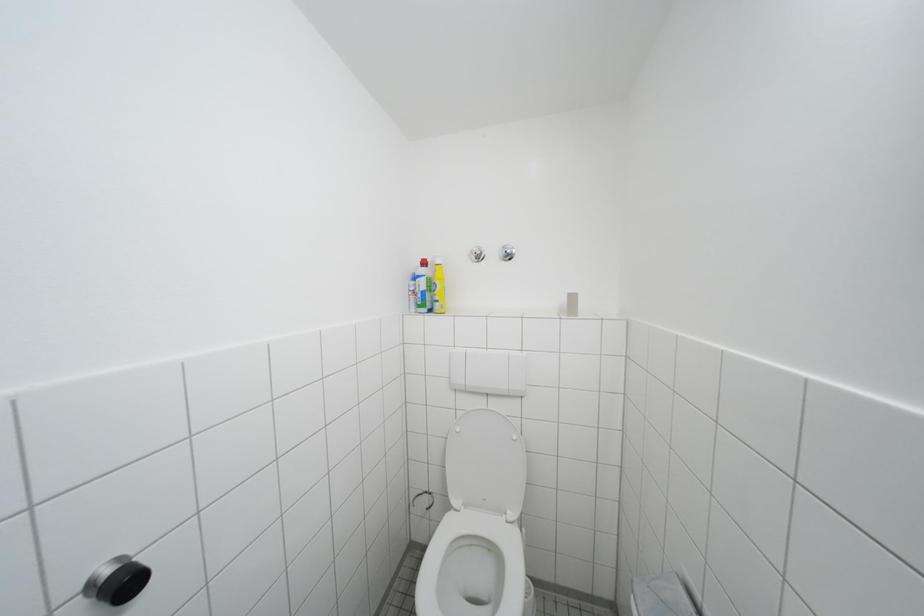
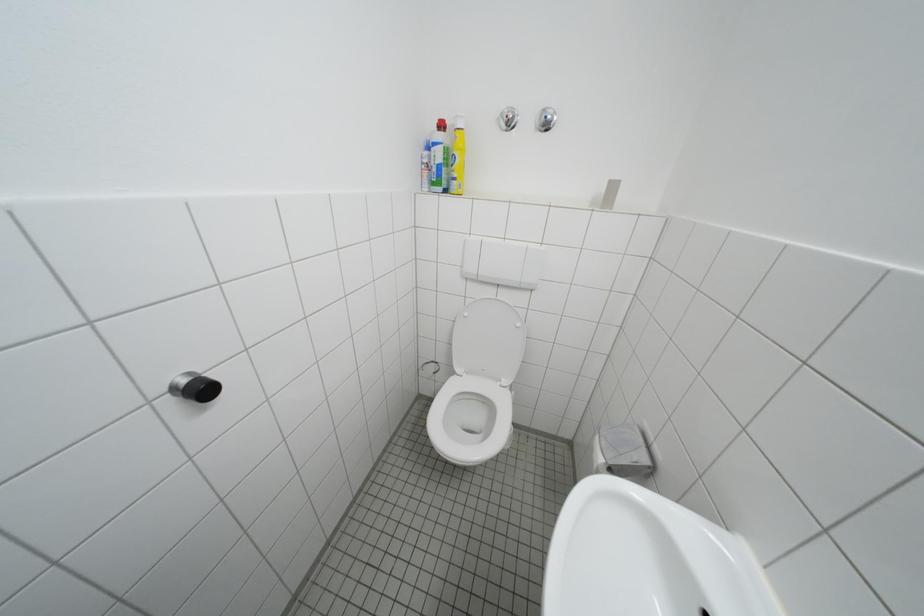
Question: The first image is from the beginning of the video and the second image is from the end. How did the camera likely rotate when shooting the video?

Choices:
 (A) Left
 (B) Right
 (C) Up
 (D) Down

Answer: (D)